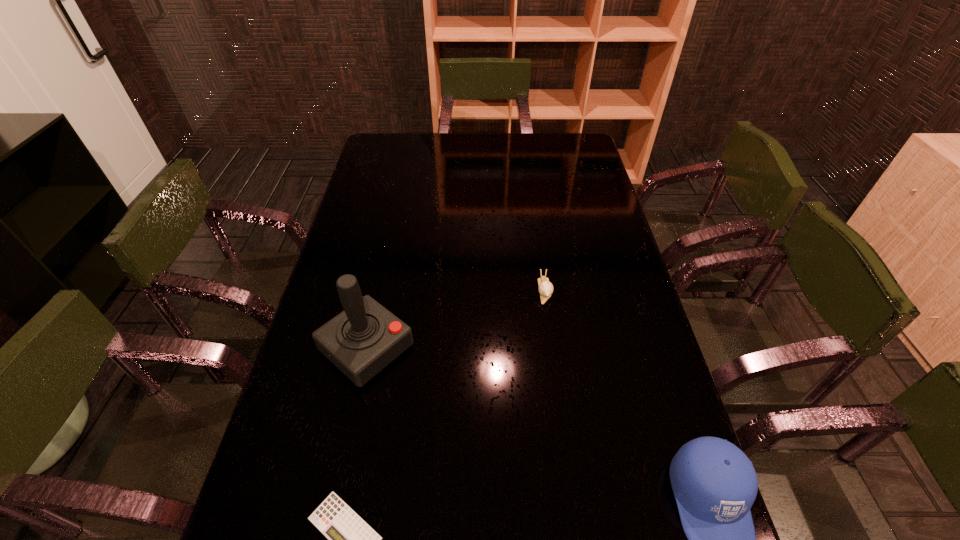
I want to click on vacant space on the desktop that is between the shortest object and the cap and is positioned on the base of the joystick, so click(560, 515).

Where is `free space on the desktop that is between the calculator and the rightmost object and is positioned on the shell of the third object from left to right`? The image size is (960, 540). free space on the desktop that is between the calculator and the rightmost object and is positioned on the shell of the third object from left to right is located at coordinates (581, 514).